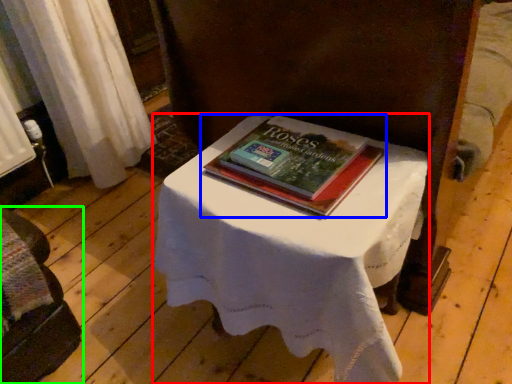
Question: Which is nearer to the table (highlighted by a red box)? book (highlighted by a blue box) or furniture (highlighted by a green box).

Choices:
 (A) book
 (B) furniture

Answer: (A)